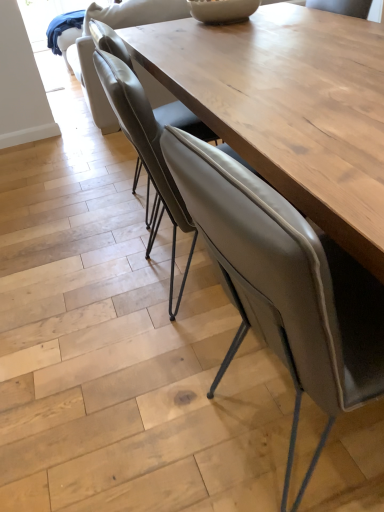
Question: Does leather armchair at upper center have a lesser width compared to matte gray chair at center, the 1th chair when ordered from front to back?

Choices:
 (A) yes
 (B) no

Answer: (B)

Question: From the image's perspective, does leather armchair at upper center appear lower than matte gray chair at center, the 1th chair when ordered from front to back?

Choices:
 (A) no
 (B) yes

Answer: (A)

Question: Does leather armchair at upper center appear on the left side of matte gray chair at center, the 1th chair when ordered from front to back?

Choices:
 (A) yes
 (B) no

Answer: (A)

Question: Is leather armchair at upper center at the right side of matte gray chair at center, the 1th chair when ordered from front to back?

Choices:
 (A) no
 (B) yes

Answer: (A)

Question: Is leather armchair at upper center outside of matte gray chair at center, which appears as the 3th chair when viewed from the back?

Choices:
 (A) yes
 (B) no

Answer: (A)

Question: Is matte gray chair at center, which appears as the 3th chair when viewed from the back, inside the boundaries of leather armchair at upper center, or outside?

Choices:
 (A) inside
 (B) outside

Answer: (B)

Question: From a real-world perspective, is matte gray chair at center, which appears as the 3th chair when viewed from the back, positioned above or below leather armchair at upper center?

Choices:
 (A) above
 (B) below

Answer: (B)

Question: Considering the positions of matte gray chair at center, the 1th chair when ordered from front to back, and leather armchair at upper center in the image, is matte gray chair at center, the 1th chair when ordered from front to back, bigger or smaller than leather armchair at upper center?

Choices:
 (A) small
 (B) big

Answer: (A)

Question: From the image's perspective, relative to leather armchair at upper center, is matte gray chair at center, which appears as the 3th chair when viewed from the back, above or below?

Choices:
 (A) below
 (B) above

Answer: (A)

Question: Does point (87, 30) appear closer or farther from the camera than point (306, 476)?

Choices:
 (A) closer
 (B) farther

Answer: (B)

Question: From their relative heights in the image, would you say leather armchair at upper center is taller or shorter than matte gray chair at center, the 1th chair when ordered from front to back?

Choices:
 (A) tall
 (B) short

Answer: (B)

Question: From the image's perspective, is leather armchair at upper center located above or below matte gray chair at center, the 1th chair when ordered from front to back?

Choices:
 (A) below
 (B) above

Answer: (B)

Question: Is leather armchair at upper center inside the boundaries of matte gray chair at center, which appears as the 3th chair when viewed from the back, or outside?

Choices:
 (A) outside
 (B) inside

Answer: (A)

Question: From a real-world perspective, is matte gray chair at center, the 1th chair when ordered from front to back, physically located above or below matte gray chair at center, positioned as the second chair in back-to-front order?

Choices:
 (A) above
 (B) below

Answer: (B)

Question: Would you say matte gray chair at center, the 1th chair when ordered from front to back, is inside or outside matte gray chair at center, the 2th chair from the front?

Choices:
 (A) outside
 (B) inside

Answer: (A)